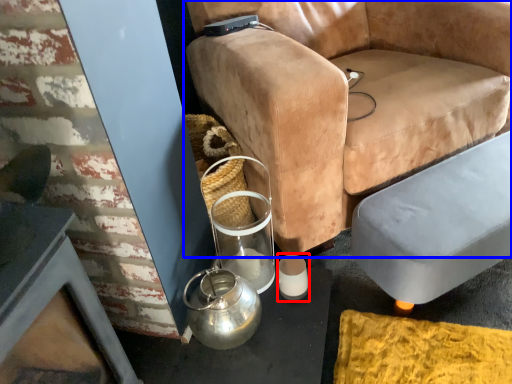
Question: Which point is closer to the camera, candle holder (highlighted by a red box) or chair (highlighted by a blue box)?

Choices:
 (A) candle holder
 (B) chair

Answer: (B)